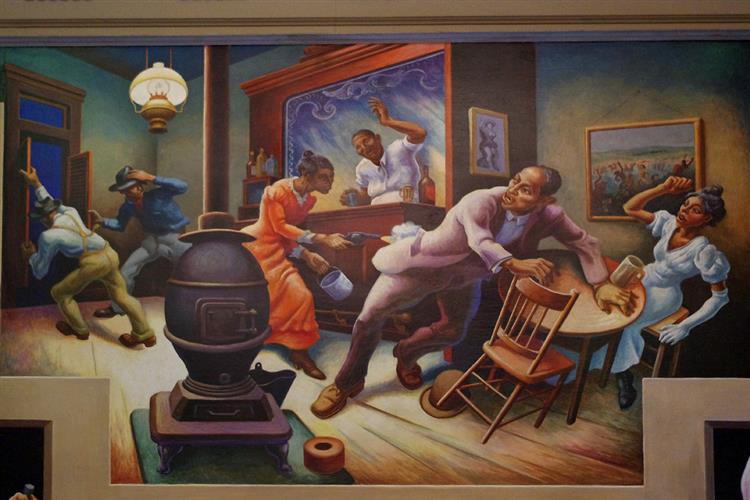
Where is `floor`? The height and width of the screenshot is (500, 750). floor is located at coordinates (411, 434).